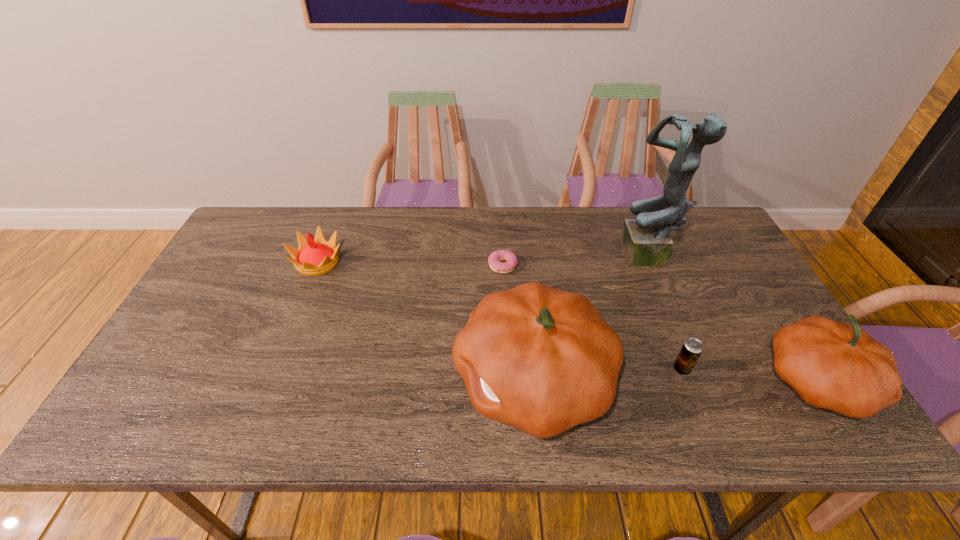
Locate an element on the screen. The width and height of the screenshot is (960, 540). the second tallest object is located at coordinates [543, 360].

The width and height of the screenshot is (960, 540). In order to click on the left pumpkin in this screenshot , I will do `click(543, 360)`.

This screenshot has height=540, width=960. Find the location of `the right pumpkin`. the right pumpkin is located at coordinates (832, 365).

Where is `the shorter pumpkin`? The height and width of the screenshot is (540, 960). the shorter pumpkin is located at coordinates (832, 365).

Find the location of a particular element. sculpture is located at coordinates (645, 241).

Find the location of a particular element. The height and width of the screenshot is (540, 960). the fourth tallest object is located at coordinates (315, 256).

The image size is (960, 540). Identify the location of crown. (315, 256).

The image size is (960, 540). In order to click on doughnut in this screenshot , I will do `click(495, 258)`.

Locate an element on the screen. This screenshot has width=960, height=540. the fifth tallest object is located at coordinates click(x=692, y=348).

Find the location of a particular element. This screenshot has height=540, width=960. free space located 0.340m on the front face of the left pumpkin is located at coordinates (309, 380).